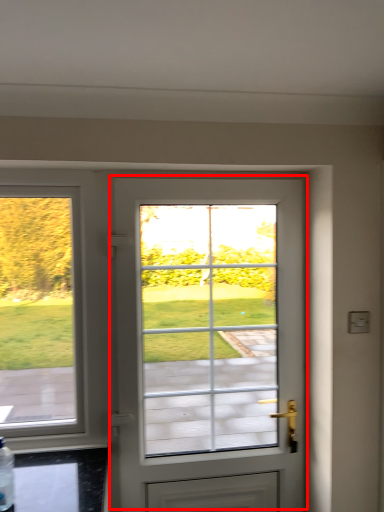
Question: From the image's perspective, considering the relative positions of door (annotated by the red box) and bottle in the image provided, where is door (annotated by the red box) located with respect to the staircase?

Choices:
 (A) above
 (B) below

Answer: (A)